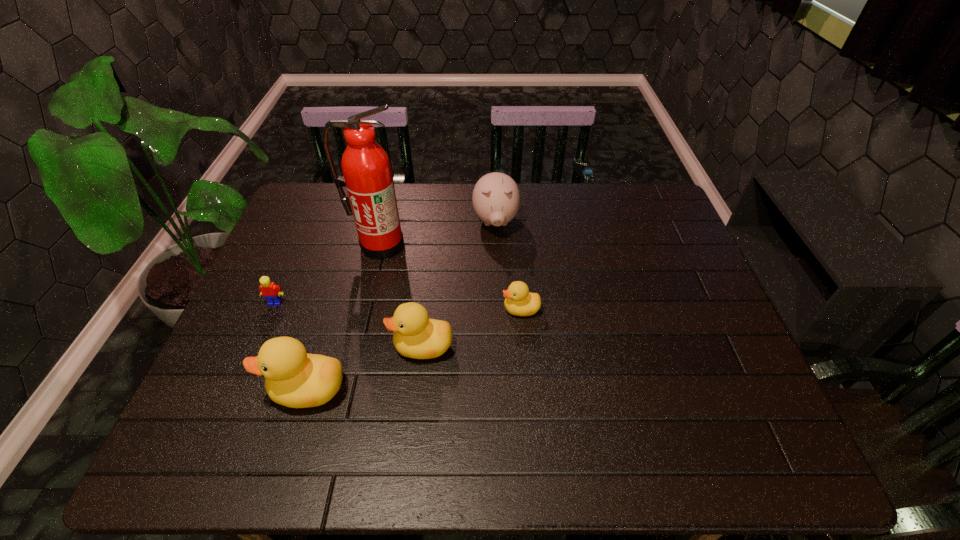
Find the location of `the leftmost duckling`. the leftmost duckling is located at coordinates (294, 378).

Where is `the nearest duckling`? the nearest duckling is located at coordinates (294, 378).

I want to click on the second farthest duckling, so click(416, 336).

Where is `the fifth farthest object`? the fifth farthest object is located at coordinates (416, 336).

At what (x,y) coordinates should I click in order to perform the action: click on the rightmost duckling. Please return your answer as a coordinate pair (x, y). The height and width of the screenshot is (540, 960). Looking at the image, I should click on (519, 301).

You are a GUI agent. You are given a task and a screenshot of the screen. Output one action in this format:
    pyautogui.click(x=<x>, y=<y>)
    Task: Click on the shortest duckling
    
    Given the screenshot: What is the action you would take?
    pyautogui.click(x=519, y=301)

Where is `fire extinguisher`? The width and height of the screenshot is (960, 540). fire extinguisher is located at coordinates (367, 175).

Locate an element on the screen. This screenshot has height=540, width=960. piggy bank is located at coordinates (496, 199).

Locate an element on the screen. This screenshot has width=960, height=540. the leftmost object is located at coordinates (271, 292).

Where is `vacant space located 0.100m on the face of the nearest duckling`? vacant space located 0.100m on the face of the nearest duckling is located at coordinates (224, 389).